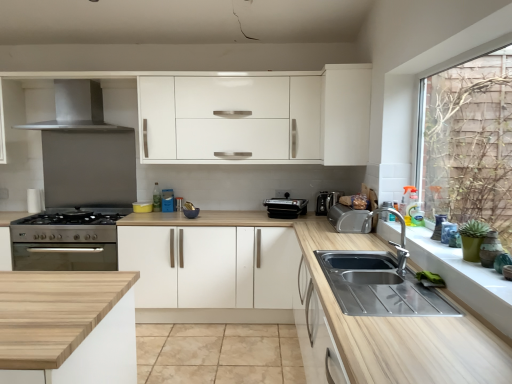
Question: Can you confirm if satin silver coffee machine at center is thinner than black plastic toaster at center, which is the second appliance in left-to-right order?

Choices:
 (A) yes
 (B) no

Answer: (A)

Question: From the image's perspective, does satin silver coffee machine at center appear lower than black plastic toaster at center, which is the second appliance in left-to-right order?

Choices:
 (A) no
 (B) yes

Answer: (A)

Question: Can you confirm if satin silver coffee machine at center is shorter than black plastic toaster at center, the fourth appliance when ordered from front to back?

Choices:
 (A) no
 (B) yes

Answer: (A)

Question: From the image's perspective, is satin silver coffee machine at center located above black plastic toaster at center, which is the second appliance in left-to-right order?

Choices:
 (A) no
 (B) yes

Answer: (B)

Question: Can you confirm if satin silver coffee machine at center is wider than black plastic toaster at center, acting as the 1th appliance starting from the back?

Choices:
 (A) no
 (B) yes

Answer: (A)

Question: From a real-world perspective, is satin silver coffee machine at center below black plastic toaster at center, acting as the 1th appliance starting from the back?

Choices:
 (A) no
 (B) yes

Answer: (A)

Question: Can you confirm if white matte cabinet at upper center, the first cabinetry when ordered from top to bottom, is bigger than white matte cabinet at center, marked as the second cabinetry in a right-to-left arrangement?

Choices:
 (A) no
 (B) yes

Answer: (A)

Question: Does white matte cabinet at upper center, which is the 1th cabinetry from right to left, lie behind white matte cabinet at center, marked as the second cabinetry in a right-to-left arrangement?

Choices:
 (A) no
 (B) yes

Answer: (A)

Question: Is white matte cabinet at upper center, which is the 1th cabinetry from right to left, touching white matte cabinet at center, which is counted as the 1th cabinetry, starting from the left?

Choices:
 (A) yes
 (B) no

Answer: (B)

Question: Is white matte cabinet at upper center, the first cabinetry when ordered from top to bottom, not inside white matte cabinet at center, which is the 1th cabinetry in bottom-to-top order?

Choices:
 (A) no
 (B) yes

Answer: (B)

Question: Does white matte cabinet at upper center, the first cabinetry when ordered from top to bottom, turn towards white matte cabinet at center, marked as the second cabinetry in a right-to-left arrangement?

Choices:
 (A) yes
 (B) no

Answer: (B)

Question: Considering the relative sizes of white matte cabinet at upper center, the first cabinetry when ordered from top to bottom, and white matte cabinet at center, marked as the second cabinetry in a right-to-left arrangement, in the image provided, is white matte cabinet at upper center, the first cabinetry when ordered from top to bottom, taller than white matte cabinet at center, marked as the second cabinetry in a right-to-left arrangement,?

Choices:
 (A) no
 (B) yes

Answer: (A)

Question: Is stainless steel cooker at left, the 4th appliance viewed from the right, next to black plastic toaster at center, the fourth appliance when ordered from front to back, and touching it?

Choices:
 (A) no
 (B) yes

Answer: (A)